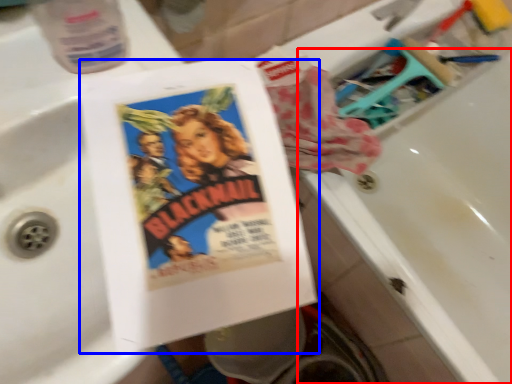
Question: Among these objects, which one is farthest to the camera, bath (highlighted by a red box) or paperback book (highlighted by a blue box)?

Choices:
 (A) bath
 (B) paperback book

Answer: (A)